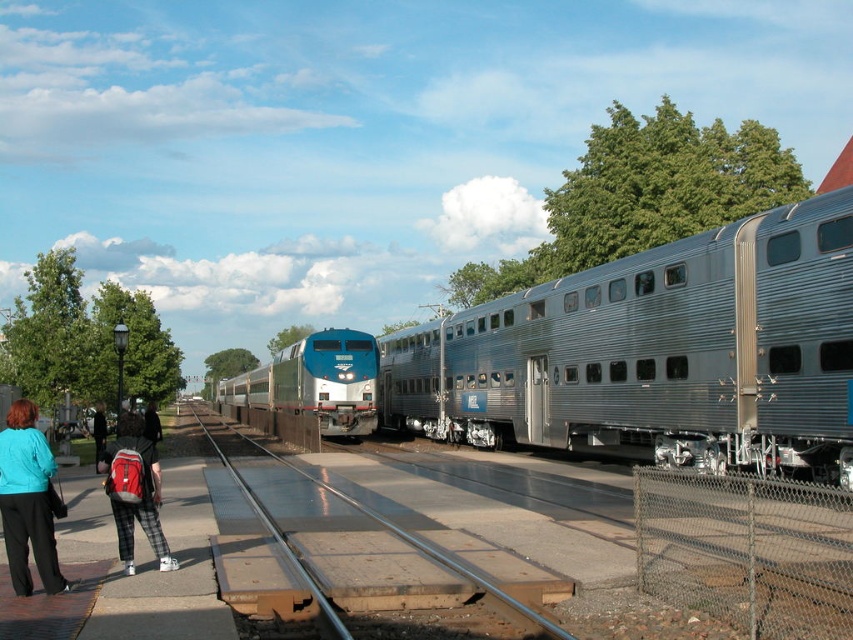
Can you confirm if silver/aluminum train car at center-right is thinner than teal fabric jacket at lower left?

No.

Based on the photo, can you confirm if silver/aluminum train car at center-right is taller than teal fabric jacket at lower left?

Yes.

Who is more forward, (685,269) or (21,412)?

Point (21,412)

Where is `silver/aluminum train car at center-right`? silver/aluminum train car at center-right is located at coordinates (656, 355).

The image size is (853, 640). Identify the location of shiny blue train at center. (315, 381).

Does shiny blue train at center lie in front of metal/smooth train track at center?

No.

Is point (273, 365) positioned after point (399, 528)?

Yes, it is behind point (399, 528).

Locate an element on the screen. This screenshot has height=640, width=853. shiny blue train at center is located at coordinates (315, 381).

Between silver/aluminum train car at center-right and metal/smooth train track at center, which one has less height?

metal/smooth train track at center is shorter.

Based on the photo, measure the distance between silver/aluminum train car at center-right and camera.

The distance of silver/aluminum train car at center-right from camera is 11.97 meters.

Describe the element at coordinates (656, 355) in the screenshot. The width and height of the screenshot is (853, 640). I see `silver/aluminum train car at center-right` at that location.

You are a GUI agent. You are given a task and a screenshot of the screen. Output one action in this format:
    pyautogui.click(x=<x>, y=<y>)
    Task: Click on the silver/aluminum train car at center-right
    The width and height of the screenshot is (853, 640).
    Given the screenshot: What is the action you would take?
    pyautogui.click(x=656, y=355)